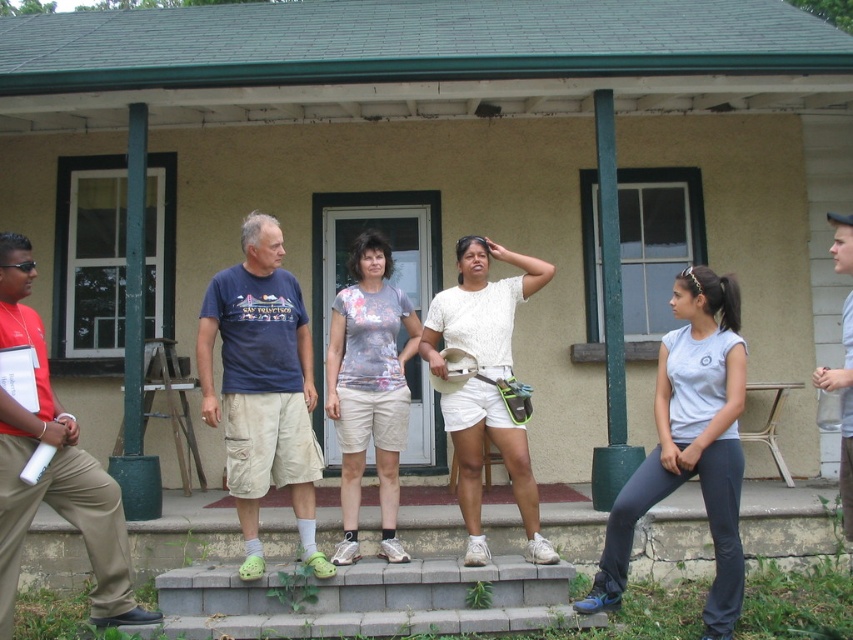
You are a photographer trying to capture a group photo of the gray fabric shirt at center and the white cotton shirt at center. Which of the two should you focus on first if you want to ensure they both fit in the frame without cropping?

The gray fabric shirt at center is bigger than the white cotton shirt at center, so you should focus on the gray fabric shirt at center first to ensure it fits properly in the frame.